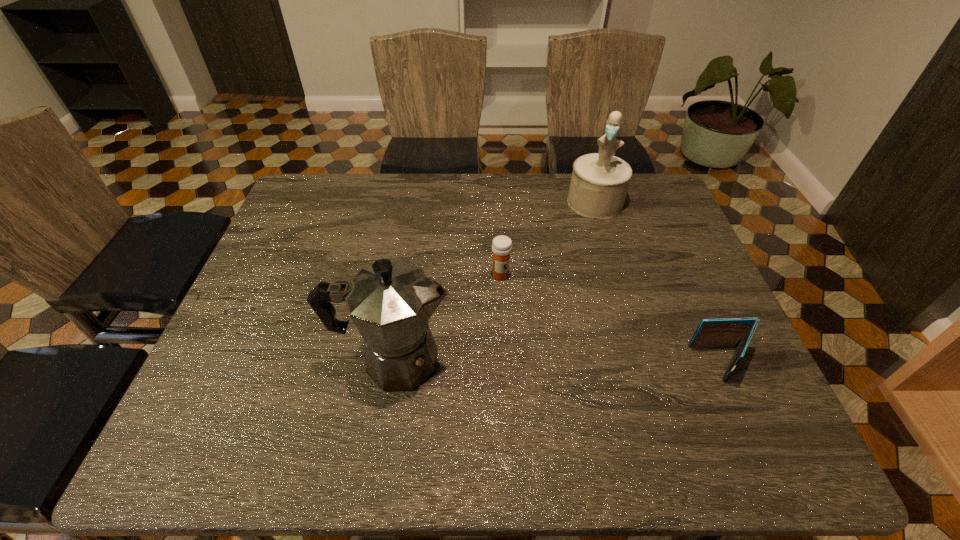
The height and width of the screenshot is (540, 960). Find the location of `vacant region between the second object from right to left and the wallet`. vacant region between the second object from right to left and the wallet is located at coordinates (659, 283).

I want to click on unoccupied position between the coffeepot and the medicine, so click(x=447, y=318).

Locate an element on the screen. This screenshot has width=960, height=540. vacant region between the second object from right to left and the shortest object is located at coordinates (659, 283).

Identify the location of unoccupied position between the shortest object and the farthest object. (659, 283).

Find the location of a particular element. The width and height of the screenshot is (960, 540). vacant area that lies between the shortest object and the coffeepot is located at coordinates (558, 362).

The width and height of the screenshot is (960, 540). I want to click on free space between the third nearest object and the wallet, so point(611,320).

The width and height of the screenshot is (960, 540). In order to click on empty space that is in between the rightmost object and the second object from left to right in this screenshot , I will do `click(611, 320)`.

Find the location of `vacant area that lies between the second object from left to right and the wallet`. vacant area that lies between the second object from left to right and the wallet is located at coordinates (611, 320).

Identify the location of free space between the figurine and the wallet. The height and width of the screenshot is (540, 960). (659, 283).

I want to click on vacant area between the medicine and the leftmost object, so click(x=447, y=318).